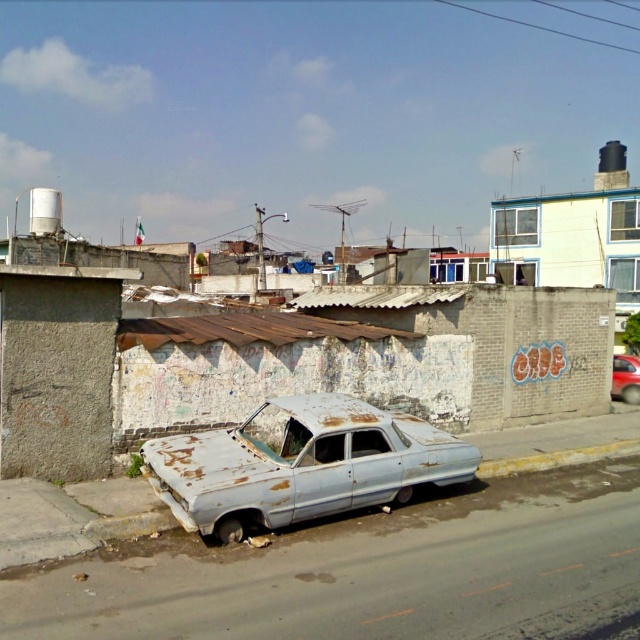
Question: Can you confirm if rusty metal car at center is smaller than shiny red car at right?

Choices:
 (A) no
 (B) yes

Answer: (A)

Question: Does rusty metal car at center have a lesser width compared to shiny red car at right?

Choices:
 (A) yes
 (B) no

Answer: (B)

Question: Which point is closer to the camera?

Choices:
 (A) shiny red car at right
 (B) rusty metal car at center

Answer: (B)

Question: Does rusty metal car at center lie behind shiny red car at right?

Choices:
 (A) yes
 (B) no

Answer: (B)